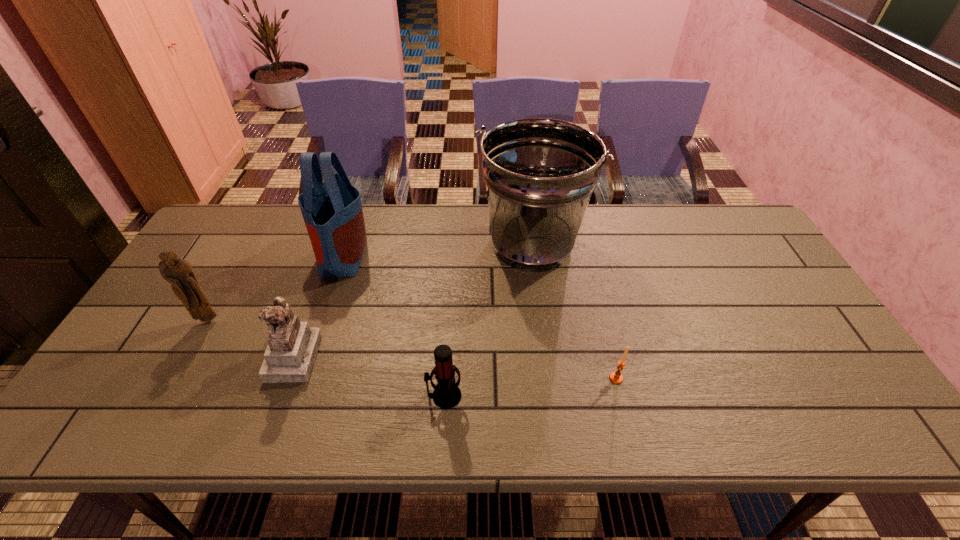
Find the location of a particular element. This screenshot has height=540, width=960. free space located 0.310m on the left of the handbag is located at coordinates (216, 253).

This screenshot has width=960, height=540. I want to click on vacant space located on the front-facing side of the farther figurine, so click(x=168, y=394).

I want to click on vacant space located 0.350m on the front-facing side of the fourth tallest object, so click(x=458, y=356).

This screenshot has height=540, width=960. In order to click on free space located on the back of the fourth object from left to right in this screenshot , I will do [447, 348].

Image resolution: width=960 pixels, height=540 pixels. What are the coordinates of `free spot located 0.370m on the back of the shortest object` in the screenshot? It's located at (588, 266).

Where is `bucket that is positioned at the far edge`? The image size is (960, 540). bucket that is positioned at the far edge is located at coordinates (540, 173).

Identify the location of handbag that is at the far edge. (332, 211).

Identify the location of object present at the near edge. The width and height of the screenshot is (960, 540). (447, 394).

I want to click on object that is at the left edge, so click(x=178, y=272).

I want to click on vacant space at the far edge of the desktop, so click(x=462, y=217).